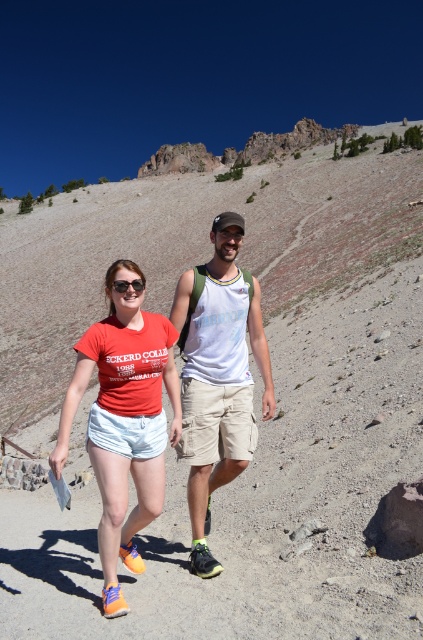
Which is above, white cotton tank top at center or matte black sunglasses at center?

matte black sunglasses at center is higher up.

Is point (219, 342) closer to camera compared to point (123, 280)?

That is False.

You are a GUI agent. You are given a task and a screenshot of the screen. Output one action in this format:
    pyautogui.click(x=<x>, y=<y>)
    Task: Click on the white cotton tank top at center
    This screenshot has width=423, height=640.
    Given the screenshot: What is the action you would take?
    pyautogui.click(x=217, y=376)

Based on the photo, which is above, matte red t-shirt at center or white cotton tank top at center?

white cotton tank top at center

Is point (107, 600) farther from camera compared to point (222, 342)?

That is False.

The width and height of the screenshot is (423, 640). Find the location of `matte red t-shirt at center`. matte red t-shirt at center is located at coordinates (123, 420).

Is point (112, 460) positioned behind point (128, 285)?

No, (112, 460) is closer to viewer.

Does matte red t-shirt at center appear under matte black sunglasses at center?

Yes.

Is point (112, 433) positioned after point (118, 285)?

No, it is not.

At what (x,y) coordinates should I click in order to perform the action: click on matte red t-shirt at center. Please return your answer as a coordinate pair (x, y). The width and height of the screenshot is (423, 640). Looking at the image, I should click on (123, 420).